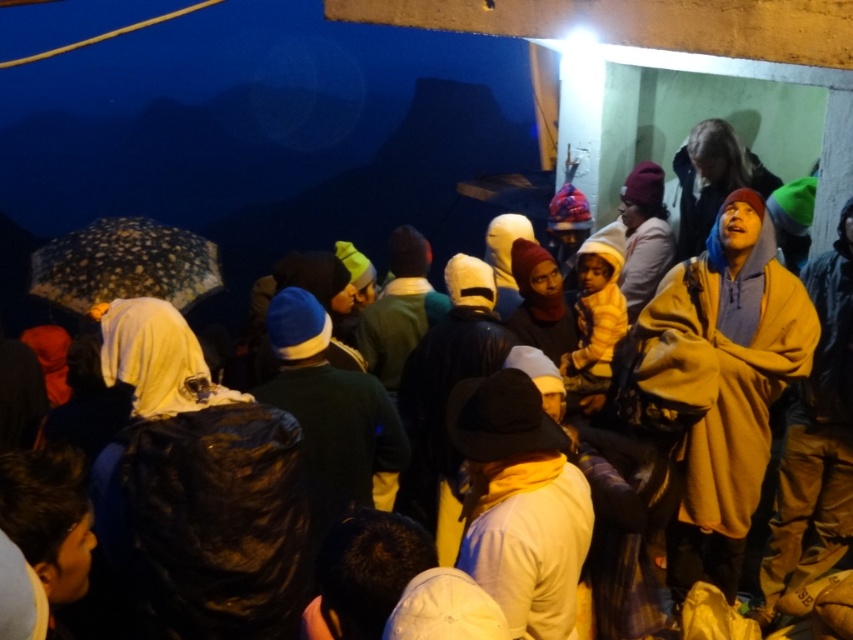
Between point (750, 408) and point (114, 237), which one is positioned in front?

Point (750, 408) is more forward.

Who is positioned more to the right, brown fleece jacket at right or speckled fabric umbrella at left?

From the viewer's perspective, brown fleece jacket at right appears more on the right side.

Which is behind, point (741, 240) or point (140, 292)?

Point (140, 292)

Locate an element on the screen. brown fleece jacket at right is located at coordinates (721, 381).